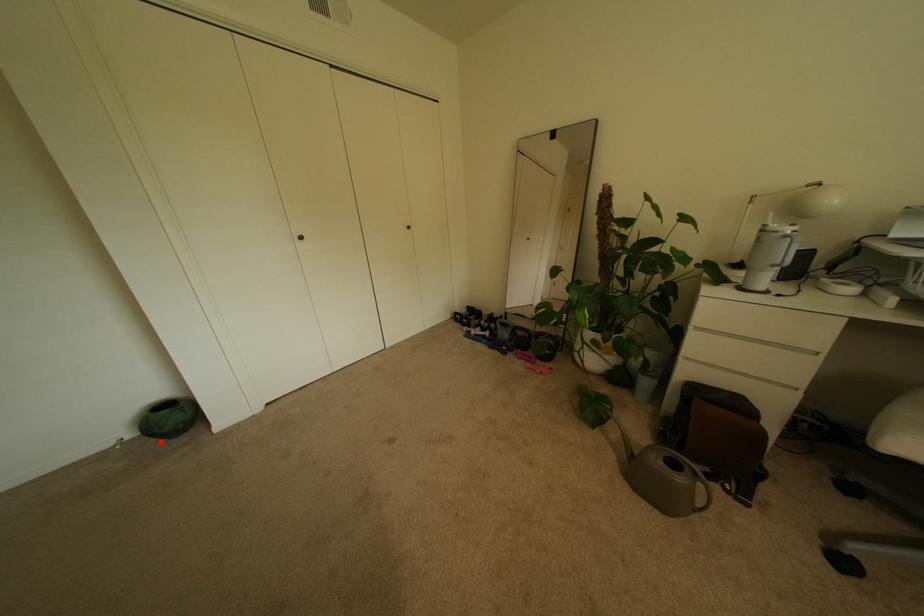
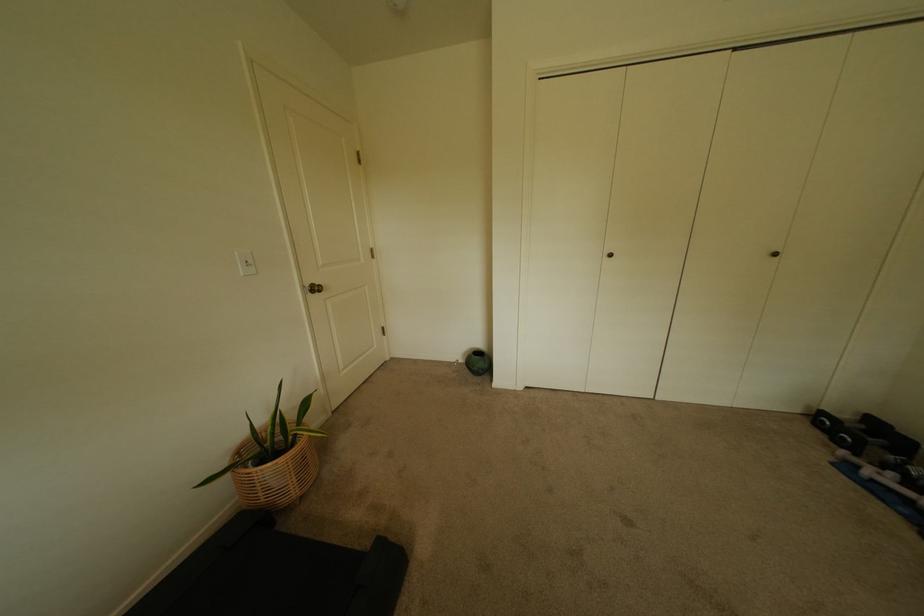
Question: I am providing you with two images of the same scene from different viewpoints. In image1, a red point is highlighted. Considering the same 3D point in image2, which of the following is correct?

Choices:
 (A) It is closer
 (B) It is farther

Answer: (B)